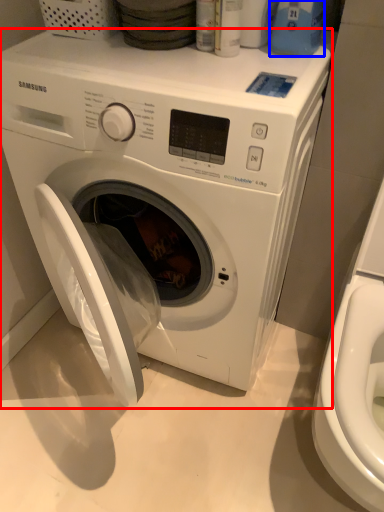
Question: Among these objects, which one is nearest to the camera, washing machine (highlighted by a red box) or cleaning product (highlighted by a blue box)?

Choices:
 (A) washing machine
 (B) cleaning product

Answer: (A)